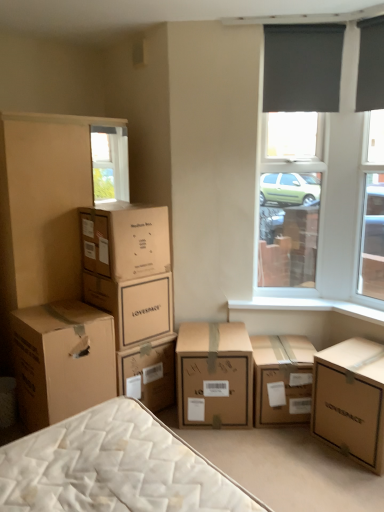
Question: Choose the correct answer: Is brown cardboard box at center, marked as the fifth box in a left-to-right arrangement, inside brown cardboard box at upper left, placed as the 5th box when sorted from right to left, or outside it?

Choices:
 (A) outside
 (B) inside

Answer: (A)

Question: Relative to brown cardboard box at upper left, positioned as the second box in left-to-right order, is brown cardboard box at center, acting as the second box starting from the right, in front or behind?

Choices:
 (A) front
 (B) behind

Answer: (B)

Question: Based on their relative distances, which object is farther from the brown cardboard box at lower left, the 6th box when ordered from right to left?

Choices:
 (A) brown cardboard box at upper left, placed as the 5th box when sorted from right to left
 (B) brown cardboard box at center, marked as the fifth box in a left-to-right arrangement
 (C) lovespace cardboard box at lower right, acting as the first box starting from the right
 (D) dark gray fabric at upper right
 (E) brown cardboard box at center-left, the 3th box viewed from the left

Answer: (D)

Question: Which is nearer to the brown cardboard box at center, acting as the second box starting from the right?

Choices:
 (A) brown cardboard box at center, which is the 3th box from right to left
 (B) dark gray fabric at upper right
 (C) brown cardboard box at upper left, placed as the 5th box when sorted from right to left
 (D) lovespace cardboard box at lower right, acting as the first box starting from the right
 (E) brown cardboard box at center-left, the 4th box when ordered from right to left

Answer: (A)